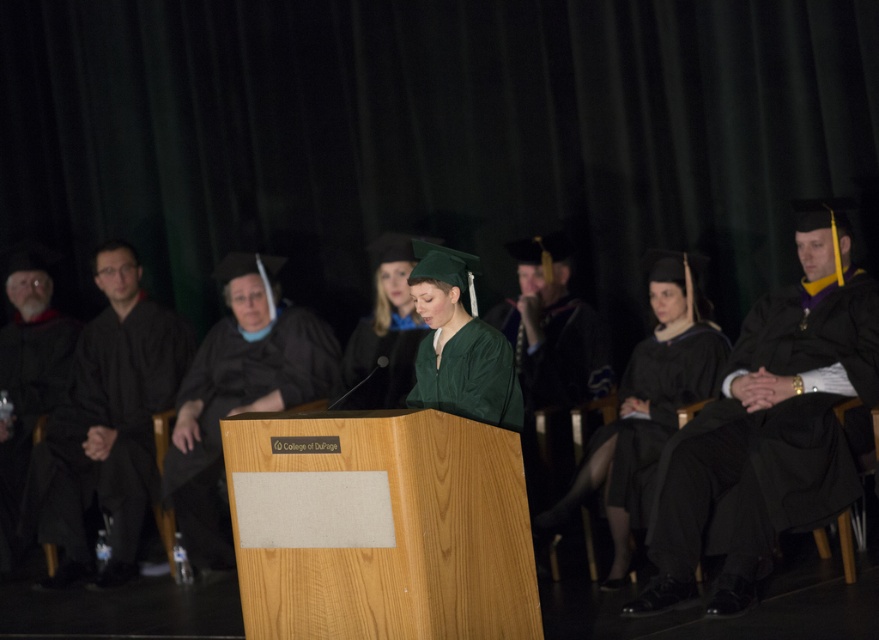
From the picture: Which is below, green velvet graduation gown at center or green matte graduation gown at center?

green velvet graduation gown at center is lower down.

Does green velvet graduation gown at center have a greater height compared to green matte graduation gown at center?

In fact, green velvet graduation gown at center may be shorter than green matte graduation gown at center.

The image size is (879, 640). Identify the location of green velvet graduation gown at center. 459,346.

Does black matte graduation gown at right have a smaller size compared to green matte graduation gown at center?

No, black matte graduation gown at right is not smaller than green matte graduation gown at center.

Is black matte graduation gown at right wider than green matte graduation gown at center?

Yes.

Is point (801, 449) farther from viewer compared to point (349, 364)?

No, (801, 449) is closer to viewer.

You are a GUI agent. You are given a task and a screenshot of the screen. Output one action in this format:
    pyautogui.click(x=<x>, y=<y>)
    Task: Click on the black matte graduation gown at right
    The image size is (879, 640).
    Given the screenshot: What is the action you would take?
    pos(769,426)

Between black matte graduation gown at right and black matte graduation gown at left, which one has less height?

Standing shorter between the two is black matte graduation gown at right.

Which is below, black matte graduation gown at right or black matte graduation gown at left?

black matte graduation gown at left is lower down.

Who is more forward, (699, 515) or (78, 381)?

Point (699, 515) is in front.

Find the location of a particular element. The height and width of the screenshot is (640, 879). black matte graduation gown at right is located at coordinates (769, 426).